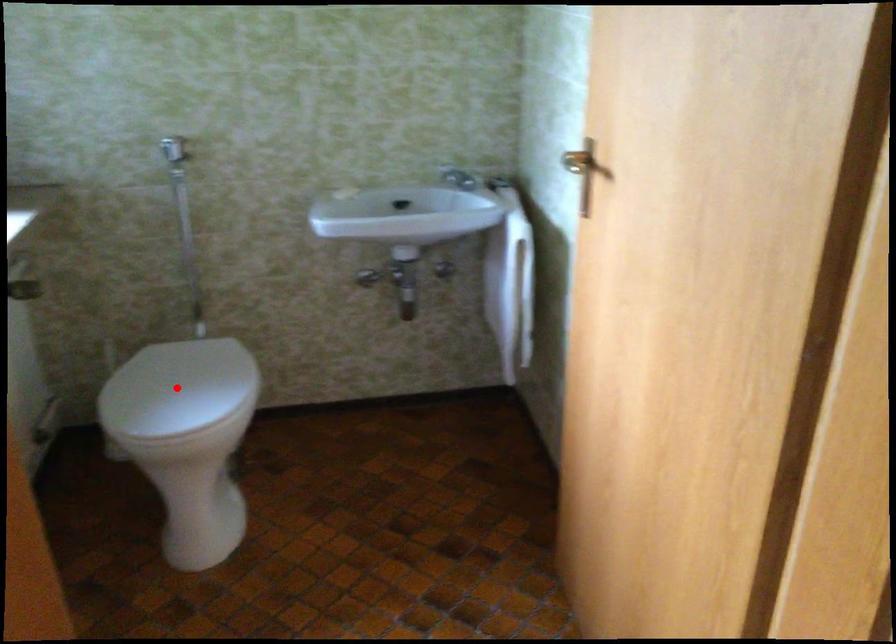
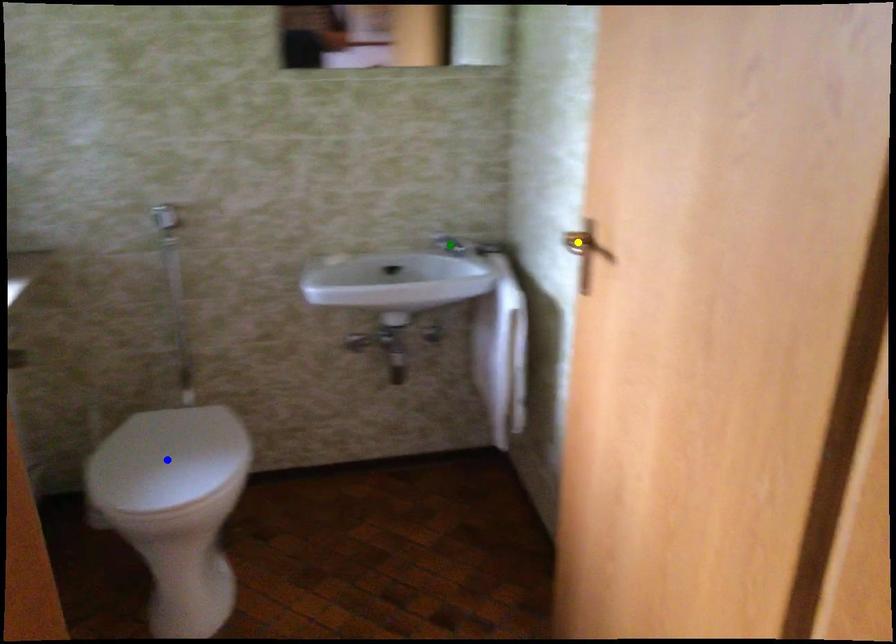
Question: I am providing you with two images of the same scene from different viewpoints. A red point is marked on the first image. You are given multiple points on the second image. Which mark in image 2 goes with the point in image 1?

Choices:
 (A) green point
 (B) blue point
 (C) yellow point

Answer: (B)